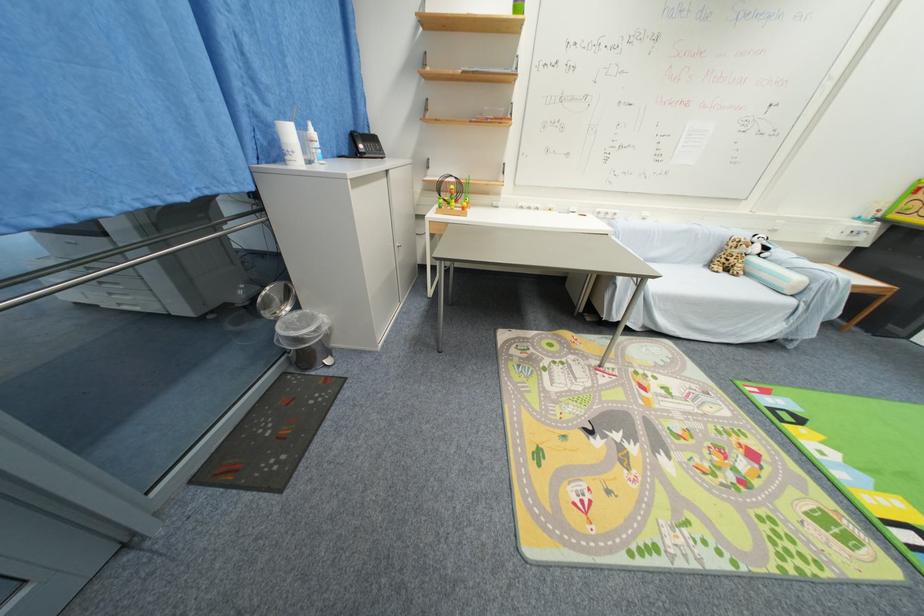
Describe the element at coordinates (305, 339) in the screenshot. This screenshot has height=616, width=924. I see `the trash can lid` at that location.